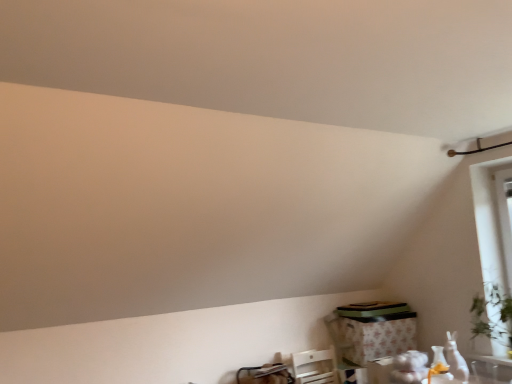
The width and height of the screenshot is (512, 384). What do you see at coordinates (315, 367) in the screenshot?
I see `white plastic chair at lower right` at bounding box center [315, 367].

Measure the distance between point (333,353) and camera.

They are 12.19 feet apart.

Where is `white plastic chair at lower right`? This screenshot has height=384, width=512. white plastic chair at lower right is located at coordinates (315, 367).

You are a GUI agent. You are given a task and a screenshot of the screen. Output one action in this format:
    pyautogui.click(x=<x>, y=<y>)
    Task: Click on the white plastic chair at lower right
    
    Given the screenshot: What is the action you would take?
    pyautogui.click(x=315, y=367)